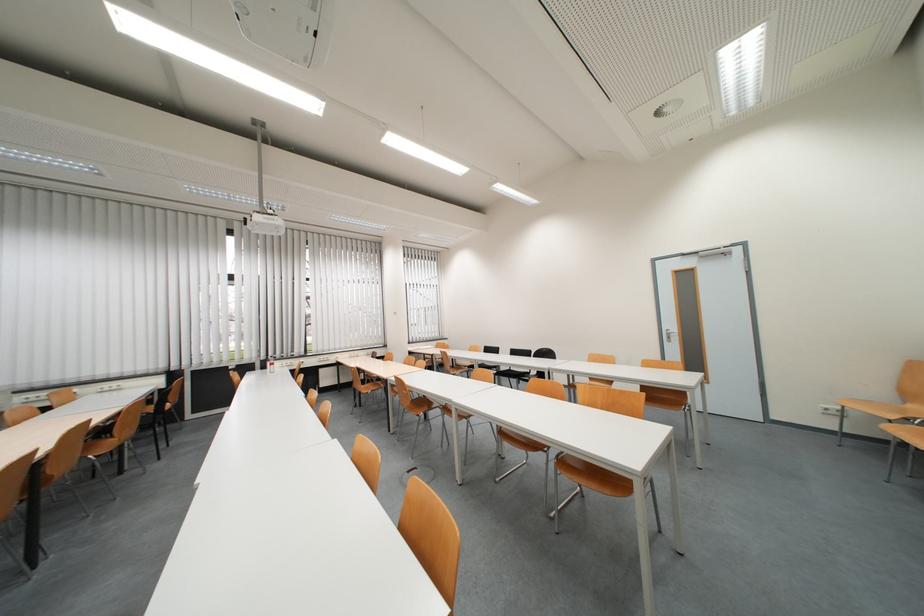
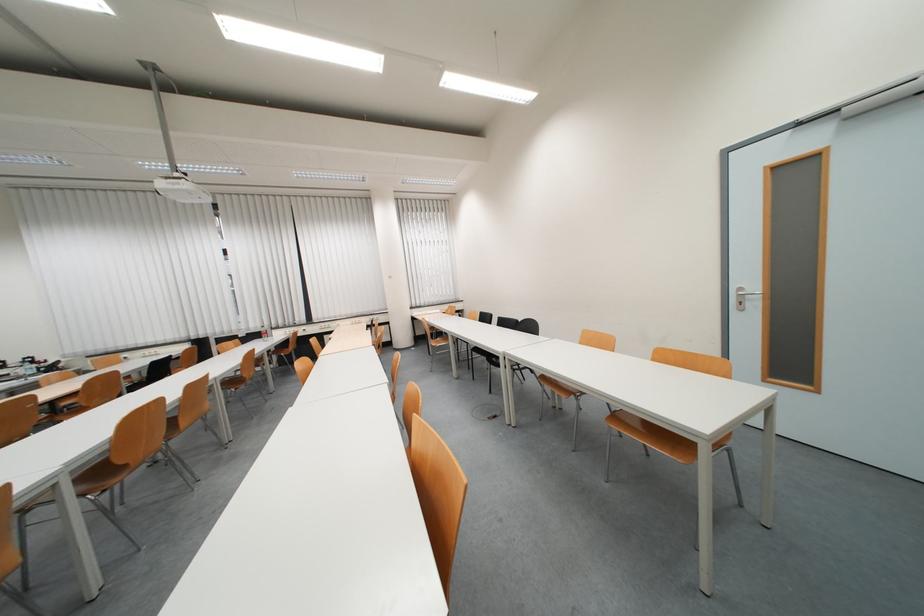
In a continuous first-person perspective shot, in which direction is the camera moving?

The cameraman walked toward right, forward.